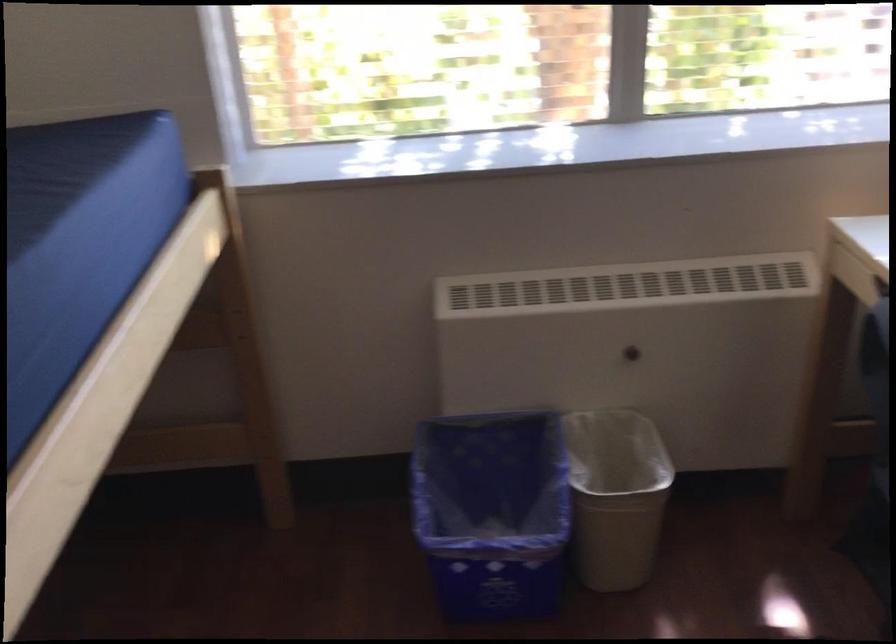
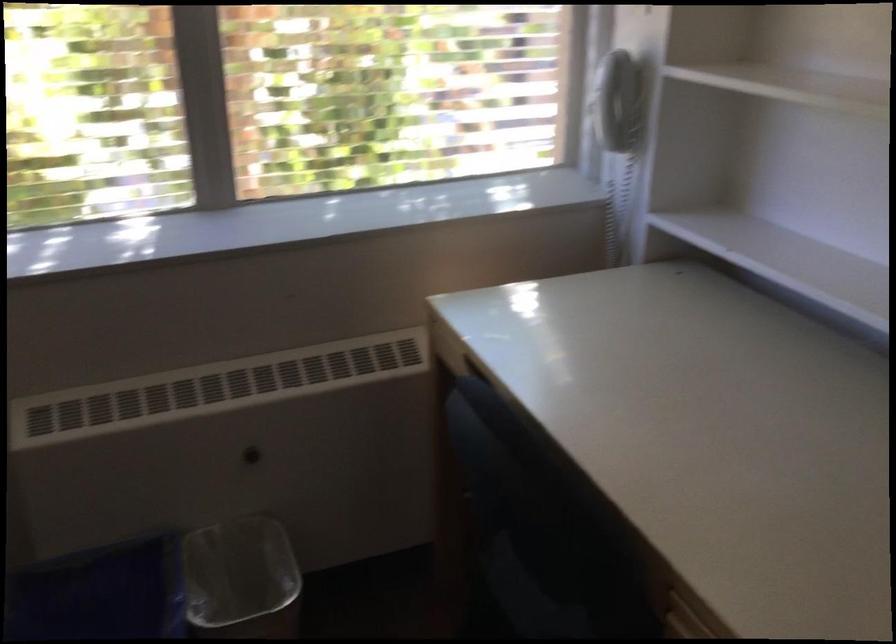
Question: In a continuous first-person perspective shot, in which direction is the camera moving?

Choices:
 (A) Left
 (B) Right
 (C) Forward
 (D) Backward

Answer: (B)